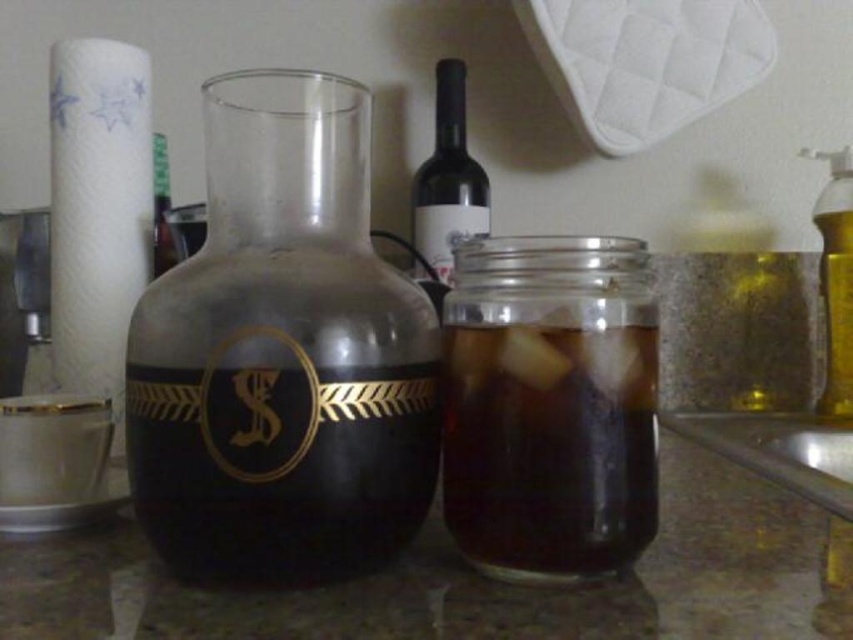
Question: Considering the real-world distances, which object is farthest from the white paper towel at left?

Choices:
 (A) transparent glass carafe at center
 (B) matte glass wine bottle at center

Answer: (A)

Question: From the image, what is the correct spatial relationship of transparent glass carafe at center in relation to transparent glass jar at center?

Choices:
 (A) right
 (B) left

Answer: (B)

Question: Considering the real-world distances, which object is farthest from the matte glass wine bottle at center?

Choices:
 (A) transparent glass carafe at center
 (B) transparent glass jar at center

Answer: (B)

Question: Is transparent glass carafe at center smaller than matte glass wine bottle at center?

Choices:
 (A) yes
 (B) no

Answer: (A)

Question: Can you confirm if transparent glass carafe at center is positioned above transparent glass jar at center?

Choices:
 (A) yes
 (B) no

Answer: (A)

Question: Which object appears closest to the camera in this image?

Choices:
 (A) matte glass wine bottle at center
 (B) white paper towel at left

Answer: (B)